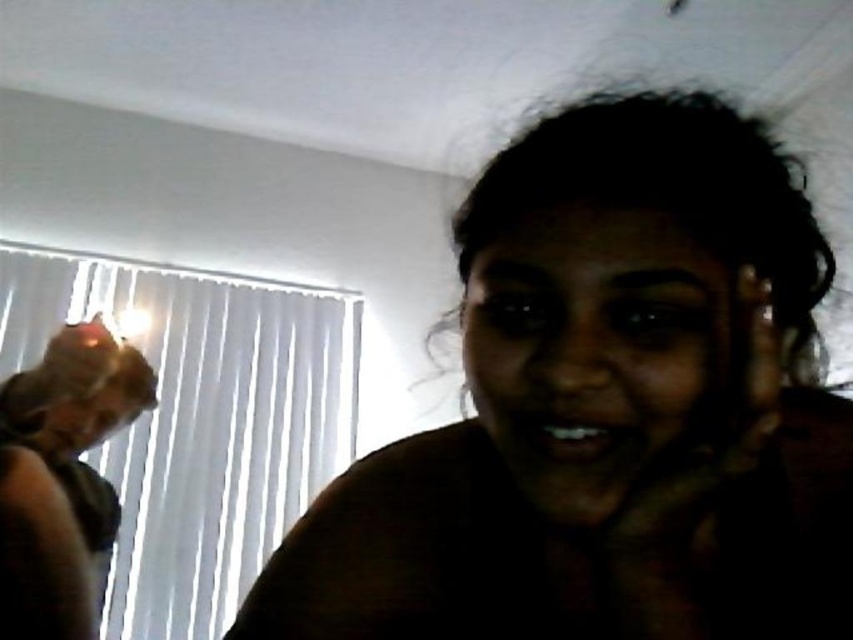
Consider the image. In the dimly lit room, there is a person with a dark skin face at center and matte black hair at left. Which object takes up more space in the image?

The matte black hair at left takes up more space in the image than the dark skin face at center because the dark skin face at center is smaller than the matte black hair at left.

You are a photographer trying to capture the perfect shot. You notice the dark skin face at center and the matte black hair at left in the frame. Which object is located higher in the image?

The dark skin face at center is positioned over matte black hair at left, so it is higher in the image.

You are a photographer setting up a photo shoot in a dimly lit room. You have two subjects, a dark skin woman at center and a matte plastic face at left. Which subject should you focus on if you want to capture a wider subject in your frame?

The dark skin woman at center should be focused on because her width is larger than the matte plastic face at left, making her the wider subject in the frame.